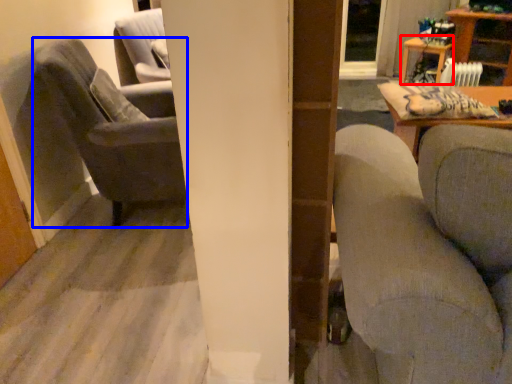
Question: Which object is further to the camera taking this photo, table (highlighted by a red box) or chair (highlighted by a blue box)?

Choices:
 (A) table
 (B) chair

Answer: (A)